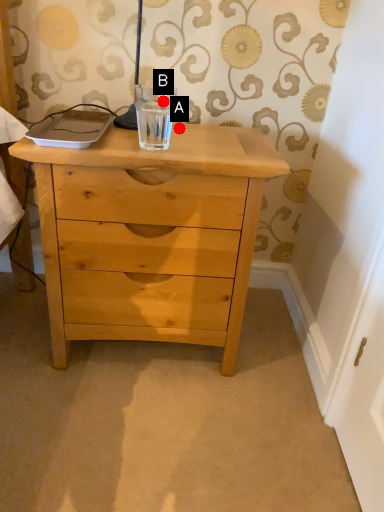
Question: Two points are circled on the image, labeled by A and B beside each circle. Which point appears closest to the camera in this image?

Choices:
 (A) A is closer
 (B) B is closer

Answer: (A)